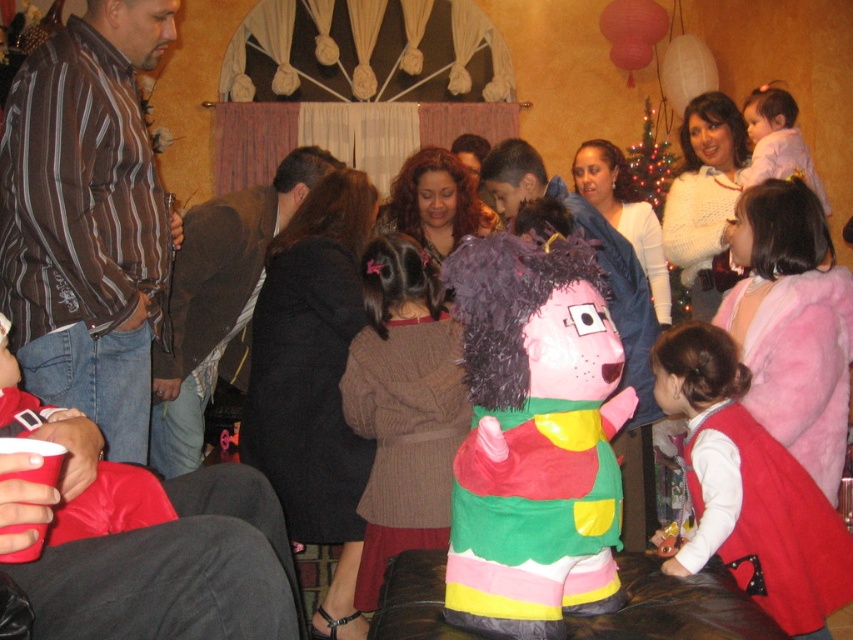
Question: Which point is closer to the camera?

Choices:
 (A) (216, 269)
 (B) (45, 262)
 (C) (555, 488)

Answer: (C)

Question: Does brown striped shirt at left appear under matte pink dress at lower right?

Choices:
 (A) no
 (B) yes

Answer: (A)

Question: Does brown striped shirt at left appear on the left side of black wool dress at center?

Choices:
 (A) yes
 (B) no

Answer: (A)

Question: Which point is farther to the camera?

Choices:
 (A) black wool dress at center
 (B) brown knitted dress at center

Answer: (A)

Question: Is plush pink pinata at center below brown striped shirt at left?

Choices:
 (A) yes
 (B) no

Answer: (A)

Question: Which of these objects is positioned farthest from the brown knitted dress at center?

Choices:
 (A) plush pink pinata at center
 (B) brown striped shirt at left
 (C) matte pink dress at lower right
 (D) black wool dress at center

Answer: (A)